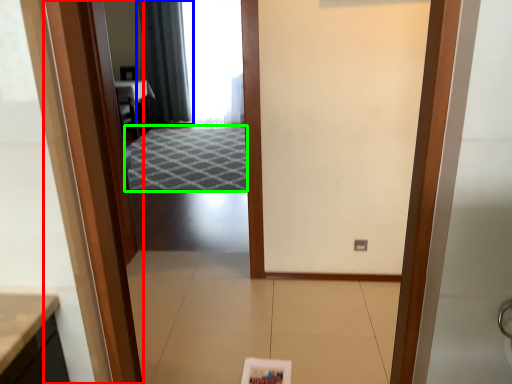
Question: Considering the real-world distances, which object is closest to door (highlighted by a red box)? curtain (highlighted by a blue box) or doormat (highlighted by a green box).

Choices:
 (A) curtain
 (B) doormat

Answer: (B)